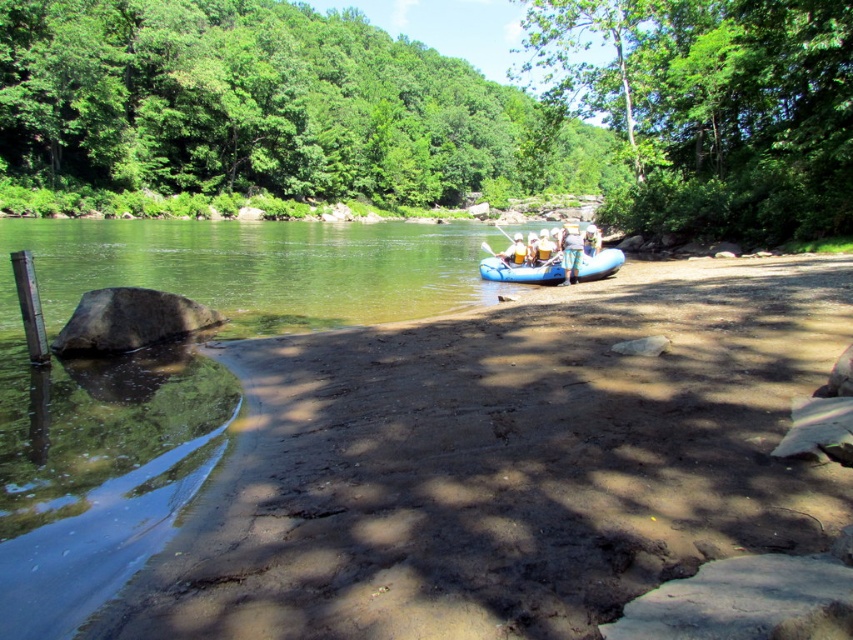
Can you confirm if blue rubber raft at center is wider than white fabric raft at center?

Yes.

Based on the photo, does blue rubber raft at center appear under white fabric raft at center?

Yes.

Is point (543, 266) less distant than point (505, 260)?

Yes.

Where is `blue rubber raft at center`? The image size is (853, 640). blue rubber raft at center is located at coordinates (521, 269).

Does blue rubber raft at center have a lesser height compared to yellow fabric shirt at center?

Correct, blue rubber raft at center is not as tall as yellow fabric shirt at center.

This screenshot has width=853, height=640. What are the coordinates of `blue rubber raft at center` in the screenshot? It's located at (521, 269).

At what (x,y) coordinates should I click in order to perform the action: click on blue rubber raft at center. Please return your answer as a coordinate pair (x, y). Image resolution: width=853 pixels, height=640 pixels. Looking at the image, I should click on (521, 269).

Between blue rubber raft at center and blue fabric raft at center, which one is positioned higher?

Positioned higher is blue fabric raft at center.

Is point (579, 273) positioned in front of point (572, 257)?

No.

Describe the element at coordinates (521, 269) in the screenshot. This screenshot has width=853, height=640. I see `blue rubber raft at center` at that location.

Identify the location of blue rubber raft at center. (521, 269).